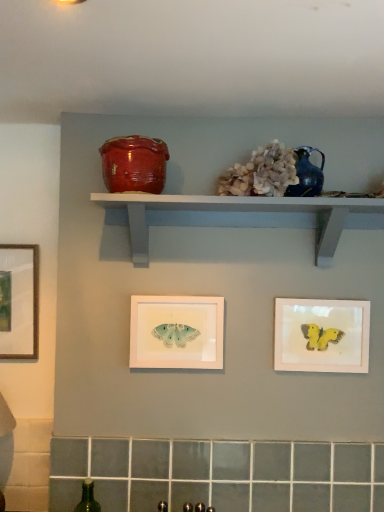
Identify the location of white painted wood shelf at upper center. (239, 211).

Measure the distance between matte pink picture frame at lower right, which ranks as the 2th picture frame in left-to-right order, and camera.

The depth of matte pink picture frame at lower right, which ranks as the 2th picture frame in left-to-right order, is 1.23 meters.

Identify the location of matte pink picture frame at lower right, which ranks as the first picture frame in right-to-left order. This screenshot has height=512, width=384. (321, 335).

Where is `glossy ceramic jar at upper center`? This screenshot has height=512, width=384. glossy ceramic jar at upper center is located at coordinates (134, 164).

Image resolution: width=384 pixels, height=512 pixels. In order to click on white painted wood shelf at upper center in this screenshot , I will do pyautogui.click(x=239, y=211).

How different are the orientations of white matte butterfly at center, which is the first picture frame from left to right, and teal ceramic vase at upper center in degrees?

0.401 degrees.

Measure the distance between white matte butterfly at center, which is the first picture frame from left to right, and teal ceramic vase at upper center.

A distance of 19.10 inches exists between white matte butterfly at center, which is the first picture frame from left to right, and teal ceramic vase at upper center.

Is white matte butterfly at center, which is the first picture frame from left to right, turned away from teal ceramic vase at upper center?

No.

Is white matte butterfly at center, which is the first picture frame from left to right, far from teal ceramic vase at upper center?

white matte butterfly at center, which is the first picture frame from left to right, is actually quite close to teal ceramic vase at upper center.

Is white painted wood shelf at upper center turned away from matte pink picture frame at lower right, which ranks as the 2th picture frame in left-to-right order?

white painted wood shelf at upper center does not have its back to matte pink picture frame at lower right, which ranks as the 2th picture frame in left-to-right order.

From the image's perspective, is white painted wood shelf at upper center over matte pink picture frame at lower right, which ranks as the 2th picture frame in left-to-right order?

Yes, from the image's perspective, white painted wood shelf at upper center is over matte pink picture frame at lower right, which ranks as the 2th picture frame in left-to-right order.

Is white painted wood shelf at upper center situated inside matte pink picture frame at lower right, which ranks as the first picture frame in right-to-left order, or outside?

white painted wood shelf at upper center is not inside matte pink picture frame at lower right, which ranks as the first picture frame in right-to-left order, it's outside.

Is matte pink picture frame at lower right, which ranks as the 2th picture frame in left-to-right order, situated inside glossy ceramic jar at upper center or outside?

matte pink picture frame at lower right, which ranks as the 2th picture frame in left-to-right order, is spatially situated outside glossy ceramic jar at upper center.

Is matte pink picture frame at lower right, which ranks as the 2th picture frame in left-to-right order, beside glossy ceramic jar at upper center?

They are not placed beside each other.

The image size is (384, 512). Find the location of `pottery located in front of the matte pink picture frame at lower right, which ranks as the first picture frame in right-to-left order`. pottery located in front of the matte pink picture frame at lower right, which ranks as the first picture frame in right-to-left order is located at coordinates (134, 164).

Looking at this image, considering the sizes of objects matte pink picture frame at lower right, which ranks as the first picture frame in right-to-left order, and glossy ceramic jar at upper center in the image provided, who is smaller, matte pink picture frame at lower right, which ranks as the first picture frame in right-to-left order, or glossy ceramic jar at upper center?

Smaller between the two is matte pink picture frame at lower right, which ranks as the first picture frame in right-to-left order.

From a real-world perspective, does glossy ceramic jar at upper center stand above white painted wood shelf at upper center?

Yes.

What's the angular difference between glossy ceramic jar at upper center and white painted wood shelf at upper center's facing directions?

2.95 degrees separate the facing orientations of glossy ceramic jar at upper center and white painted wood shelf at upper center.

Do you think glossy ceramic jar at upper center is within white painted wood shelf at upper center, or outside of it?

glossy ceramic jar at upper center is located beyond the bounds of white painted wood shelf at upper center.

Considering their positions, is glossy ceramic jar at upper center located in front of or behind white painted wood shelf at upper center?

Visually, glossy ceramic jar at upper center is located in front of white painted wood shelf at upper center.

From the image's perspective, is glossy ceramic jar at upper center above or below matte pink picture frame at lower right, which ranks as the 2th picture frame in left-to-right order?

Based on their image positions, glossy ceramic jar at upper center is located above matte pink picture frame at lower right, which ranks as the 2th picture frame in left-to-right order.

What's the angular difference between glossy ceramic jar at upper center and matte pink picture frame at lower right, which ranks as the 2th picture frame in left-to-right order,'s facing directions?

The angular difference between glossy ceramic jar at upper center and matte pink picture frame at lower right, which ranks as the 2th picture frame in left-to-right order, is 2.96 degrees.

Is glossy ceramic jar at upper center bigger than matte pink picture frame at lower right, which ranks as the 2th picture frame in left-to-right order?

Correct, glossy ceramic jar at upper center is larger in size than matte pink picture frame at lower right, which ranks as the 2th picture frame in left-to-right order.

Is glossy ceramic jar at upper center spatially inside matte pink picture frame at lower right, which ranks as the first picture frame in right-to-left order, or outside of it?

glossy ceramic jar at upper center is outside matte pink picture frame at lower right, which ranks as the first picture frame in right-to-left order.

Is point (110, 156) positioned after point (312, 189)?

No, it is not.

Considering the relative sizes of glossy ceramic jar at upper center and teal ceramic vase at upper center in the image provided, is glossy ceramic jar at upper center shorter than teal ceramic vase at upper center?

Incorrect, the height of glossy ceramic jar at upper center does not fall short of that of teal ceramic vase at upper center.

Is glossy ceramic jar at upper center wider than teal ceramic vase at upper center?

Yes, glossy ceramic jar at upper center is wider than teal ceramic vase at upper center.

From the image's perspective, does glossy ceramic jar at upper center appear higher than teal ceramic vase at upper center?

Indeed, from the image's perspective, glossy ceramic jar at upper center is shown above teal ceramic vase at upper center.

Would you say white painted wood shelf at upper center is outside teal ceramic vase at upper center?

That's correct, white painted wood shelf at upper center is outside of teal ceramic vase at upper center.

Identify the location of teal located above the white painted wood shelf at upper center (from the image's perspective). (307, 174).

Between point (180, 197) and point (318, 181), which one is positioned in front?

The point (180, 197) is more forward.

Considering the relative positions of white painted wood shelf at upper center and teal ceramic vase at upper center in the image provided, is white painted wood shelf at upper center to the left of teal ceramic vase at upper center from the viewer's perspective?

Indeed, white painted wood shelf at upper center is positioned on the left side of teal ceramic vase at upper center.

Where is `teal above the white matte butterfly at center, the 2th picture frame viewed from the right (from the image's perspective)`? The image size is (384, 512). teal above the white matte butterfly at center, the 2th picture frame viewed from the right (from the image's perspective) is located at coordinates (307, 174).

Find the location of `shelf that is above the matte pink picture frame at lower right, which ranks as the 2th picture frame in left-to-right order (from a real-world perspective)`. shelf that is above the matte pink picture frame at lower right, which ranks as the 2th picture frame in left-to-right order (from a real-world perspective) is located at coordinates (239, 211).

From the image, which object appears to be farther from teal ceramic vase at upper center, matte pink picture frame at lower right, which ranks as the 2th picture frame in left-to-right order, or white matte butterfly at center, the 2th picture frame viewed from the right?

white matte butterfly at center, the 2th picture frame viewed from the right, is positioned further to the anchor teal ceramic vase at upper center.

Considering their positions, is white matte butterfly at center, which is the first picture frame from left to right, positioned closer to matte pink picture frame at lower right, which ranks as the first picture frame in right-to-left order, than teal ceramic vase at upper center?

Based on the image, white matte butterfly at center, which is the first picture frame from left to right, appears to be nearer to matte pink picture frame at lower right, which ranks as the first picture frame in right-to-left order.

From the image, which object appears to be nearer to matte pink picture frame at lower right, which ranks as the 2th picture frame in left-to-right order, white matte butterfly at center, which is the first picture frame from left to right, or white painted wood shelf at upper center?

white painted wood shelf at upper center is positioned closer to the anchor matte pink picture frame at lower right, which ranks as the 2th picture frame in left-to-right order.

Looking at this image, estimate the real-world distances between objects in this image. Which object is further from white matte butterfly at center, which is the first picture frame from left to right, white painted wood shelf at upper center or matte pink picture frame at lower right, which ranks as the 2th picture frame in left-to-right order?

Based on the image, matte pink picture frame at lower right, which ranks as the 2th picture frame in left-to-right order, appears to be further to white matte butterfly at center, which is the first picture frame from left to right.

Considering their positions, is matte pink picture frame at lower right, which ranks as the first picture frame in right-to-left order, positioned further to teal ceramic vase at upper center than glossy ceramic jar at upper center?

matte pink picture frame at lower right, which ranks as the first picture frame in right-to-left order, is positioned further to the anchor teal ceramic vase at upper center.

Based on their spatial positions, is matte pink picture frame at lower right, which ranks as the 2th picture frame in left-to-right order, or white matte butterfly at center, the 2th picture frame viewed from the right, further from white painted wood shelf at upper center?

matte pink picture frame at lower right, which ranks as the 2th picture frame in left-to-right order, is positioned further to the anchor white painted wood shelf at upper center.

From the image, which object appears to be nearer to white matte butterfly at center, which is the first picture frame from left to right, white painted wood shelf at upper center or teal ceramic vase at upper center?

white painted wood shelf at upper center lies closer to white matte butterfly at center, which is the first picture frame from left to right, than the other object.

Based on their spatial positions, is white painted wood shelf at upper center or white matte butterfly at center, which is the first picture frame from left to right, closer to teal ceramic vase at upper center?

Among the two, white painted wood shelf at upper center is located nearer to teal ceramic vase at upper center.

The width and height of the screenshot is (384, 512). I want to click on shelf between teal ceramic vase at upper center and matte pink picture frame at lower right, which ranks as the first picture frame in right-to-left order, in the vertical direction, so click(x=239, y=211).

What are the coordinates of `shelf situated between white matte butterfly at center, which is the first picture frame from left to right, and matte pink picture frame at lower right, which ranks as the 2th picture frame in left-to-right order, from left to right` in the screenshot? It's located at (239, 211).

Where is `shelf between glossy ceramic jar at upper center and matte pink picture frame at lower right, which ranks as the 2th picture frame in left-to-right order, from left to right`? Image resolution: width=384 pixels, height=512 pixels. shelf between glossy ceramic jar at upper center and matte pink picture frame at lower right, which ranks as the 2th picture frame in left-to-right order, from left to right is located at coordinates (239, 211).

Image resolution: width=384 pixels, height=512 pixels. What are the coordinates of `picture frame situated between glossy ceramic jar at upper center and matte pink picture frame at lower right, which ranks as the first picture frame in right-to-left order, from left to right` in the screenshot? It's located at (176, 332).